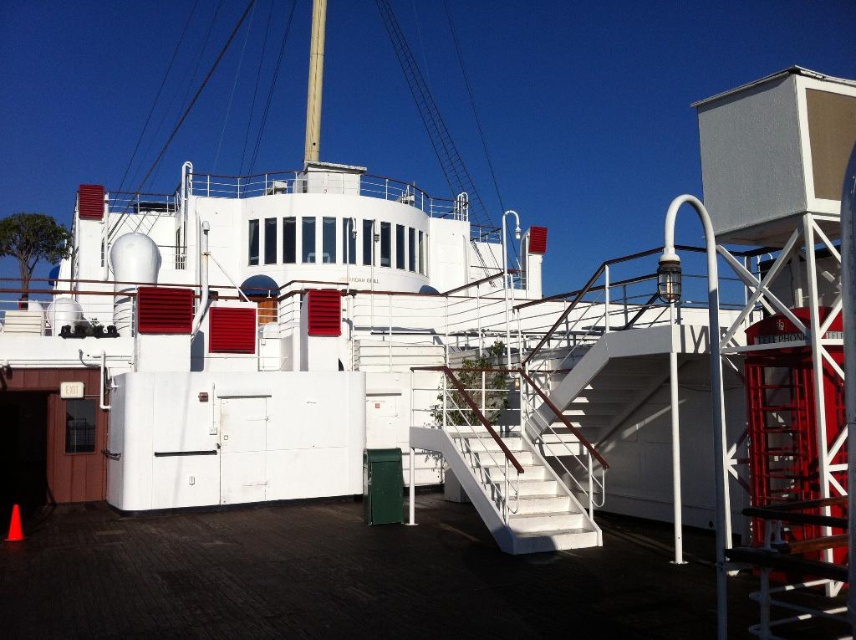
Question: Which point is closer to the camera taking this photo?

Choices:
 (A) (319, 40)
 (B) (525, 538)
 (C) (254, 564)

Answer: (C)

Question: Among these objects, which one is nearest to the camera?

Choices:
 (A) dark brown wood at lower center
 (B) white glossy staircase at center
 (C) smooth white mast at center

Answer: (A)

Question: Does white glossy staircase at center appear on the right side of smooth white mast at center?

Choices:
 (A) yes
 (B) no

Answer: (A)

Question: Which object appears farthest from the camera in this image?

Choices:
 (A) white glossy staircase at center
 (B) dark brown wood at lower center

Answer: (A)

Question: Does dark brown wood at lower center appear over smooth white mast at center?

Choices:
 (A) yes
 (B) no

Answer: (B)

Question: Is white glossy staircase at center to the left of smooth white mast at center from the viewer's perspective?

Choices:
 (A) no
 (B) yes

Answer: (A)